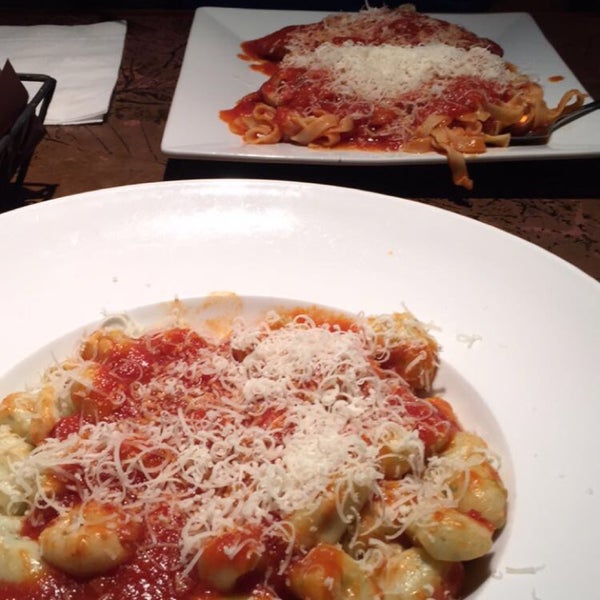
The width and height of the screenshot is (600, 600). I want to click on napkin, so click(x=72, y=88).